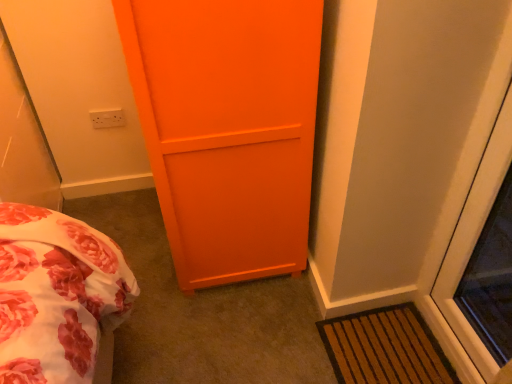
In order to face white plastic electric outlet at upper left, should I rotate leftwards or rightwards?

Rotate left and turn 18.906 degrees.

At what (x,y) coordinates should I click in order to perform the action: click on white plastic electric outlet at upper left. Please return your answer as a coordinate pair (x, y). Looking at the image, I should click on (106, 118).

What do you see at coordinates (106, 118) in the screenshot? I see `white plastic electric outlet at upper left` at bounding box center [106, 118].

You are a GUI agent. You are given a task and a screenshot of the screen. Output one action in this format:
    pyautogui.click(x=<x>, y=<y>)
    Task: Click on the white plastic electric outlet at upper left
    Image resolution: width=512 pixels, height=384 pixels.
    Given the screenshot: What is the action you would take?
    tap(106, 118)